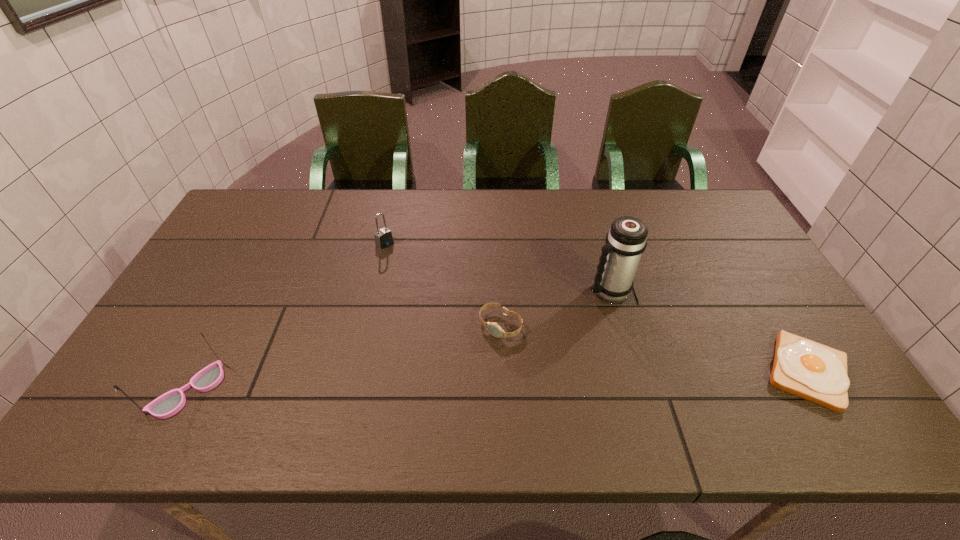
The image size is (960, 540). What are the coordinates of `vacant region located 0.140m on the face of the watch` in the screenshot? It's located at (456, 376).

Identify the location of spectacles present at the near edge. This screenshot has height=540, width=960. (170, 403).

This screenshot has height=540, width=960. In order to click on toast positioned at the near edge in this screenshot , I will do `click(812, 371)`.

Image resolution: width=960 pixels, height=540 pixels. What are the coordinates of `object at the left edge` in the screenshot? It's located at (170, 403).

Locate an element on the screen. The width and height of the screenshot is (960, 540). object present at the right edge is located at coordinates (812, 371).

I want to click on object located at the near left corner, so click(x=170, y=403).

Where is `object that is positioned at the near right corner`? The width and height of the screenshot is (960, 540). object that is positioned at the near right corner is located at coordinates (812, 371).

This screenshot has height=540, width=960. I want to click on vacant space at the far edge of the desktop, so click(x=373, y=194).

Locate an element on the screen. Image resolution: width=960 pixels, height=540 pixels. free location at the near edge of the desktop is located at coordinates (x=482, y=366).

You are a GUI agent. You are given a task and a screenshot of the screen. Output one action in this format:
    pyautogui.click(x=<x>, y=<y>)
    Task: Click on the vacant area at the left edge of the desktop
    
    Given the screenshot: What is the action you would take?
    pyautogui.click(x=202, y=310)